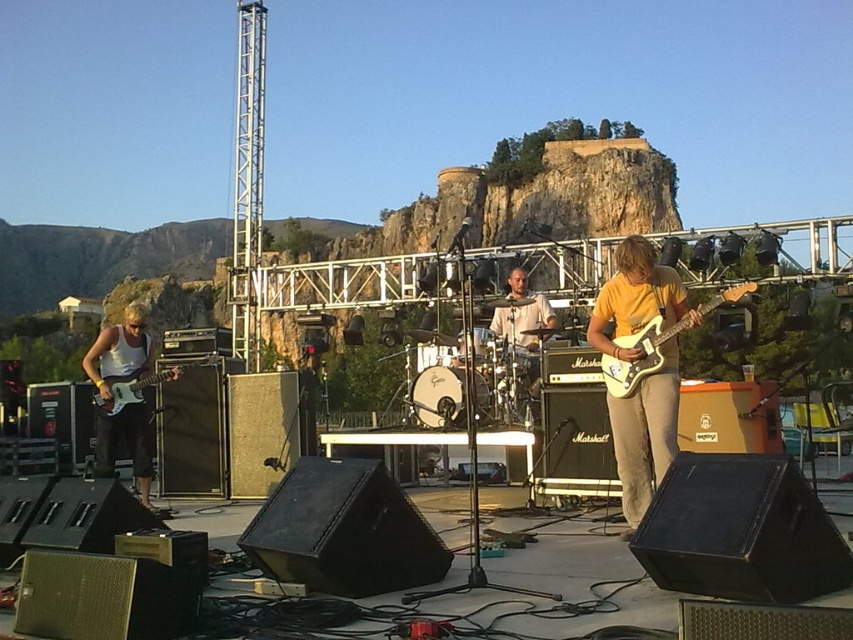
Can you confirm if yellow matte guitar at center is smaller than matte white electric guitar at left?

Actually, yellow matte guitar at center might be larger than matte white electric guitar at left.

Can you confirm if yellow matte guitar at center is positioned to the right of matte white electric guitar at left?

Indeed, yellow matte guitar at center is positioned on the right side of matte white electric guitar at left.

Does point (670, 300) lie behind point (201, 362)?

No, it is not.

Find the location of `yellow matte guitar at center`. yellow matte guitar at center is located at coordinates (645, 435).

Is light beige drum set at center bigger than white glossy electric guitar at right?

Correct, light beige drum set at center is larger in size than white glossy electric guitar at right.

Does light beige drum set at center appear on the left side of white glossy electric guitar at right?

Correct, you'll find light beige drum set at center to the left of white glossy electric guitar at right.

I want to click on light beige drum set at center, so click(524, 330).

Between light beige drum set at center and matte white electric guitar at left, which one appears on the left side from the viewer's perspective?

matte white electric guitar at left

Is point (519, 272) less distant than point (201, 365)?

No, it is behind (201, 365).

Which is in front, point (519, 320) or point (173, 378)?

Point (173, 378)

Where is `light beige drum set at center`? The height and width of the screenshot is (640, 853). light beige drum set at center is located at coordinates (524, 330).